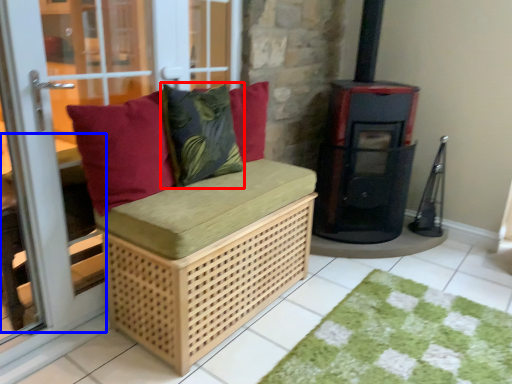
Question: Which object is closer to the camera taking this photo, throw pillow (highlighted by a red box) or table (highlighted by a blue box)?

Choices:
 (A) throw pillow
 (B) table

Answer: (B)